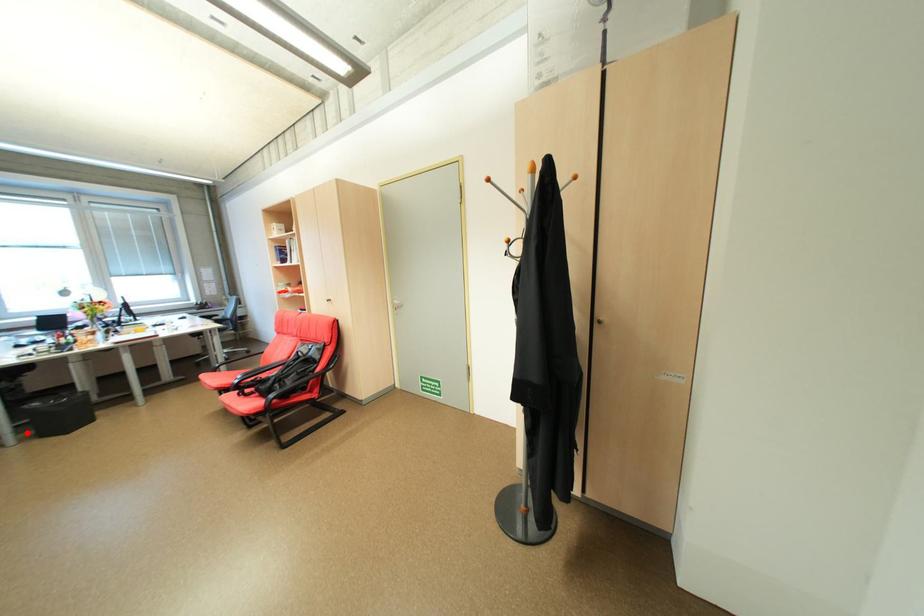
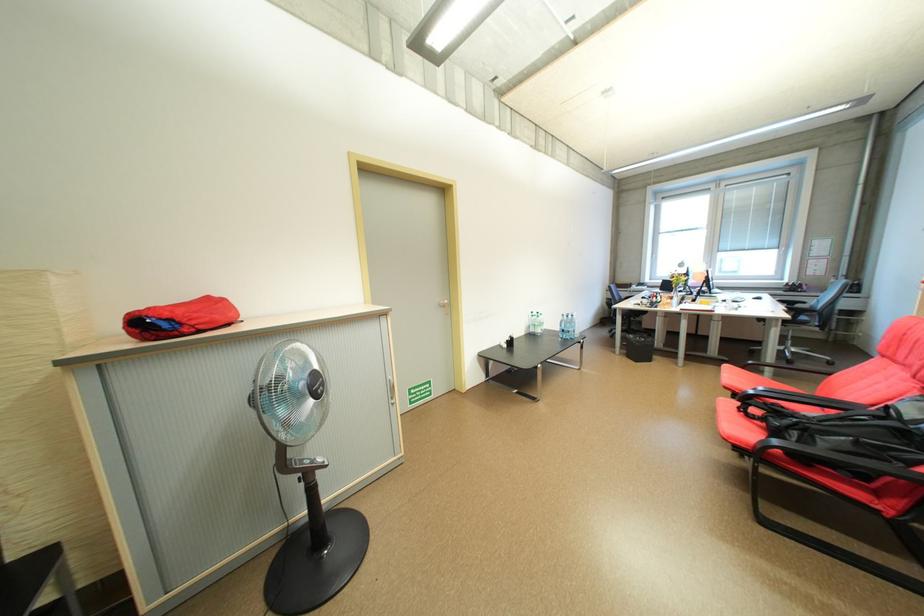
Question: I am providing you with two images of the same scene from different viewpoints. A red point is shown in image1. For the corresponding object point in image2, is it positioned nearer or farther from the camera?

Choices:
 (A) Nearer
 (B) Farther

Answer: (A)